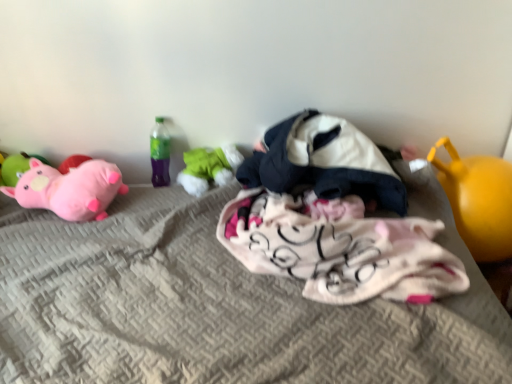
The width and height of the screenshot is (512, 384). What are the coordinates of `white soft blanket at center, placed as the 2th toy when sorted from right to left` in the screenshot? It's located at (324, 162).

This screenshot has height=384, width=512. What do you see at coordinates (69, 189) in the screenshot?
I see `matte pink plush at left, acting as the 4th toy starting from the right` at bounding box center [69, 189].

Locate an element on the screen. fluffy pink blanket at center is located at coordinates (333, 219).

What do you see at coordinates (219, 306) in the screenshot? The width and height of the screenshot is (512, 384). I see `textured gray mattress at center` at bounding box center [219, 306].

Find the location of a particular element. pink plush pig at left, the 5th toy in the right-to-left sequence is located at coordinates (16, 167).

Is matte pink plush at left, acting as the 2th toy starting from the left, to the left of textured gray mattress at center from the viewer's perspective?

Correct, you'll find matte pink plush at left, acting as the 2th toy starting from the left, to the left of textured gray mattress at center.

Are matte pink plush at left, acting as the 4th toy starting from the right, and textured gray mattress at center beside each other?

They are not placed beside each other.

Consider the image. Is matte pink plush at left, acting as the 4th toy starting from the right, located outside textured gray mattress at center?

No, most part of matte pink plush at left, acting as the 4th toy starting from the right, lies within textured gray mattress at center.

Could you tell me if green fabric toy at center, the 3th toy in the right-to-left sequence, is facing yellow rubber ball at right, which is counted as the 1th toy, starting from the right?

No.

Starting from the green fabric toy at center, the third toy when ordered from left to right, which toy is the 2nd one in front? Please provide its 2D coordinates.

[(478, 200)]

Is green fabric toy at center, the 3th toy in the right-to-left sequence, to the right of yellow rubber ball at right, which is counted as the 1th toy, starting from the right, from the viewer's perspective?

Incorrect, green fabric toy at center, the 3th toy in the right-to-left sequence, is not on the right side of yellow rubber ball at right, which is counted as the 1th toy, starting from the right.

Considering the positions of points (192, 163) and (502, 239), is point (192, 163) farther from camera compared to point (502, 239)?

Yes, point (192, 163) is farther from viewer.

From the picture: Could you tell me if matte pink plush at left, acting as the 4th toy starting from the right, is turned towards white soft blanket at center, which is counted as the fourth toy, starting from the left?

No, matte pink plush at left, acting as the 4th toy starting from the right, is not oriented towards white soft blanket at center, which is counted as the fourth toy, starting from the left.

Is matte pink plush at left, acting as the 2th toy starting from the left, to the right of white soft blanket at center, which is counted as the fourth toy, starting from the left, from the viewer's perspective?

No, matte pink plush at left, acting as the 2th toy starting from the left, is not to the right of white soft blanket at center, which is counted as the fourth toy, starting from the left.

From the image's perspective, between matte pink plush at left, acting as the 4th toy starting from the right, and white soft blanket at center, which is counted as the fourth toy, starting from the left, who is located below?

matte pink plush at left, acting as the 4th toy starting from the right, appears lower in the image.

From a real-world perspective, who is located lower, matte pink plush at left, acting as the 4th toy starting from the right, or white soft blanket at center, placed as the 2th toy when sorted from right to left?

matte pink plush at left, acting as the 4th toy starting from the right, is physically lower.

Between matte pink plush at left, acting as the 2th toy starting from the left, and fluffy pink blanket at center, which one has larger width?

Wider between the two is fluffy pink blanket at center.

In the scene shown: Is matte pink plush at left, acting as the 2th toy starting from the left, positioned with its back to fluffy pink blanket at center?

No, matte pink plush at left, acting as the 2th toy starting from the left, is not facing the opposite direction of fluffy pink blanket at center.

From a real-world perspective, starting from the fluffy pink blanket at center, which toy is the 1st one below it? Please provide its 2D coordinates.

[(69, 189)]

From the image's perspective, does textured gray mattress at center appear higher than matte pink plush at left, acting as the 4th toy starting from the right?

No, from the image's perspective, textured gray mattress at center is not over matte pink plush at left, acting as the 4th toy starting from the right.

Between textured gray mattress at center and matte pink plush at left, acting as the 4th toy starting from the right, which one is positioned behind?

matte pink plush at left, acting as the 4th toy starting from the right, is further away from the camera.

Measure the distance from textured gray mattress at center to matte pink plush at left, acting as the 4th toy starting from the right.

textured gray mattress at center is 13.06 inches away from matte pink plush at left, acting as the 4th toy starting from the right.

There is a textured gray mattress at center. Where is `the 2nd toy above it (from the image's perspective)`? the 2nd toy above it (from the image's perspective) is located at coordinates (69, 189).

Is yellow rubber ball at right, acting as the fifth toy starting from the left, far from textured gray mattress at center?

No, yellow rubber ball at right, acting as the fifth toy starting from the left, is in close proximity to textured gray mattress at center.

In the image, is yellow rubber ball at right, acting as the fifth toy starting from the left, on the left side or the right side of textured gray mattress at center?

Clearly, yellow rubber ball at right, acting as the fifth toy starting from the left, is on the right of textured gray mattress at center in the image.

From the picture: Looking at their sizes, would you say yellow rubber ball at right, which is counted as the 1th toy, starting from the right, is wider or thinner than textured gray mattress at center?

Clearly, yellow rubber ball at right, which is counted as the 1th toy, starting from the right, has less width compared to textured gray mattress at center.

Which object is more forward, fluffy pink blanket at center or white soft blanket at center, which is counted as the fourth toy, starting from the left?

fluffy pink blanket at center is more forward.

Between fluffy pink blanket at center and white soft blanket at center, placed as the 2th toy when sorted from right to left, which one has less height?

fluffy pink blanket at center is shorter.

Which of these two, fluffy pink blanket at center or white soft blanket at center, which is counted as the fourth toy, starting from the left, is smaller?

white soft blanket at center, which is counted as the fourth toy, starting from the left, is smaller.

From a real-world perspective, between fluffy pink blanket at center and white soft blanket at center, which is counted as the fourth toy, starting from the left, who is vertically higher?

white soft blanket at center, which is counted as the fourth toy, starting from the left, is physically above.

Identify the location of mattress below the matte pink plush at left, acting as the 4th toy starting from the right (from a real-world perspective). This screenshot has height=384, width=512. (219, 306).

Which toy is the 2nd one when counting from the back of the yellow rubber ball at right, acting as the fifth toy starting from the left? Please provide its 2D coordinates.

[(208, 168)]

Looking at the image, which one is located closer to textured gray mattress at center, pink plush pig at left, the 5th toy in the right-to-left sequence, or fluffy pink blanket at center?

The object closer to textured gray mattress at center is fluffy pink blanket at center.

Considering their positions, is pink plush pig at left, which is the first toy in left-to-right order, positioned further to fluffy pink blanket at center than white soft blanket at center, placed as the 2th toy when sorted from right to left?

pink plush pig at left, which is the first toy in left-to-right order.

Looking at the image, which one is located closer to white soft blanket at center, placed as the 2th toy when sorted from right to left, textured gray mattress at center or green fabric toy at center, the third toy when ordered from left to right?

green fabric toy at center, the third toy when ordered from left to right, lies closer to white soft blanket at center, placed as the 2th toy when sorted from right to left, than the other object.

When comparing their distances from textured gray mattress at center, does pink plush pig at left, the 5th toy in the right-to-left sequence, or white soft blanket at center, placed as the 2th toy when sorted from right to left, seem closer?

The object closer to textured gray mattress at center is white soft blanket at center, placed as the 2th toy when sorted from right to left.

Estimate the real-world distances between objects in this image. Which object is closer to green fabric toy at center, the third toy when ordered from left to right, fluffy pink blanket at center or white soft blanket at center, placed as the 2th toy when sorted from right to left?

white soft blanket at center, placed as the 2th toy when sorted from right to left, is positioned closer to the anchor green fabric toy at center, the third toy when ordered from left to right.

From the picture: From the image, which object appears to be nearer to green fabric toy at center, the 3th toy in the right-to-left sequence, pink plush pig at left, the 5th toy in the right-to-left sequence, or matte pink plush at left, acting as the 2th toy starting from the left?

matte pink plush at left, acting as the 2th toy starting from the left.

In the scene shown: Estimate the real-world distances between objects in this image. Which object is closer to textured gray mattress at center, pink plush pig at left, the 5th toy in the right-to-left sequence, or yellow rubber ball at right, which is counted as the 1th toy, starting from the right?

The object closer to textured gray mattress at center is yellow rubber ball at right, which is counted as the 1th toy, starting from the right.

From the picture: Based on their spatial positions, is yellow rubber ball at right, which is counted as the 1th toy, starting from the right, or pink plush pig at left, the 5th toy in the right-to-left sequence, further from matte pink plush at left, acting as the 2th toy starting from the left?

yellow rubber ball at right, which is counted as the 1th toy, starting from the right, lies further to matte pink plush at left, acting as the 2th toy starting from the left, than the other object.

Locate an element on the screen. This screenshot has height=384, width=512. toy between green fabric toy at center, the 3th toy in the right-to-left sequence, and yellow rubber ball at right, which is counted as the 1th toy, starting from the right, in the horizontal direction is located at coordinates (324, 162).

Locate an element on the screen. Image resolution: width=512 pixels, height=384 pixels. mattress between matte pink plush at left, acting as the 2th toy starting from the left, and yellow rubber ball at right, acting as the fifth toy starting from the left, in the horizontal direction is located at coordinates (219, 306).

The height and width of the screenshot is (384, 512). What are the coordinates of `mattress located between matte pink plush at left, acting as the 4th toy starting from the right, and fluffy pink blanket at center in the left-right direction` in the screenshot? It's located at (219, 306).

Where is `laundry between matte pink plush at left, acting as the 2th toy starting from the left, and yellow rubber ball at right, acting as the fifth toy starting from the left, from left to right`? Image resolution: width=512 pixels, height=384 pixels. laundry between matte pink plush at left, acting as the 2th toy starting from the left, and yellow rubber ball at right, acting as the fifth toy starting from the left, from left to right is located at coordinates (333, 219).